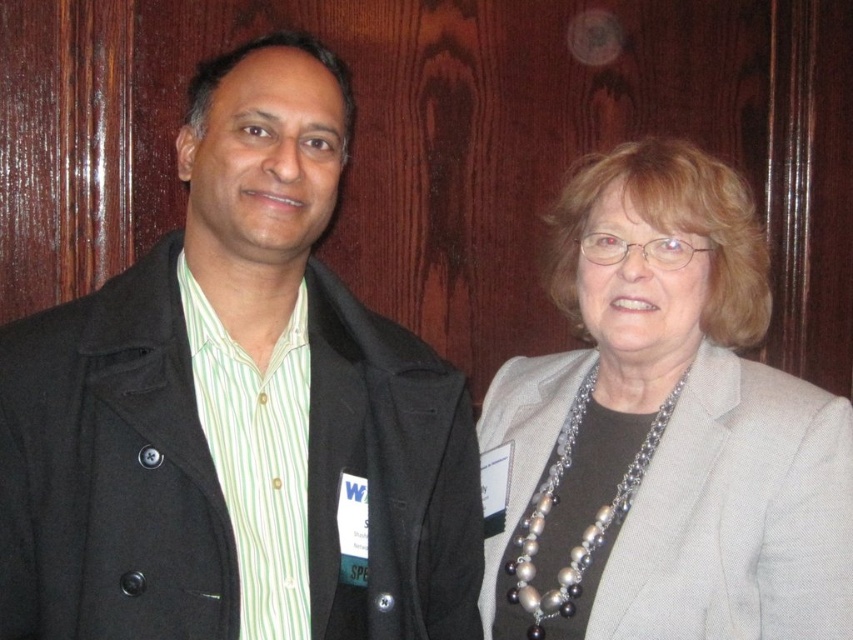
You are a photographer setting up for a formal event. You notice the gray fabric jacket at upper right and the pearl and silver chain at center in the frame. Which object is positioned higher in the image?

The gray fabric jacket at upper right is much taller as pearl and silver chain at center, so the gray fabric jacket at upper right is positioned higher in the image.

You are a photographer adjusting the framing of the image. You need to ensure that both the gray fabric jacket at upper right and the pearl and silver chain at center are fully visible in the frame. Given their sizes, which object might require more careful positioning to avoid being cut off?

The gray fabric jacket at upper right is larger in width than the pearl and silver chain at center, so it might require more careful positioning to avoid being cut off.